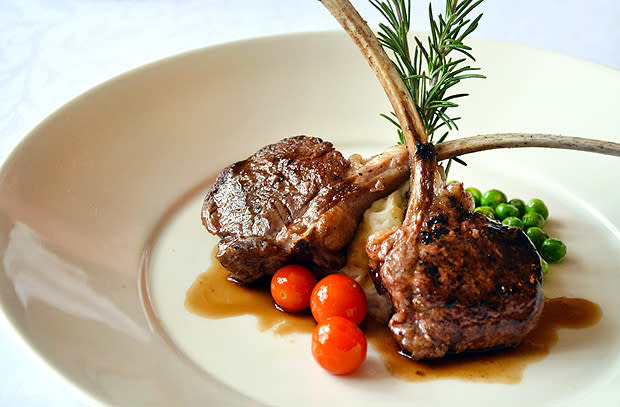
Find the location of `curved part of plate`. curved part of plate is located at coordinates (104, 213).